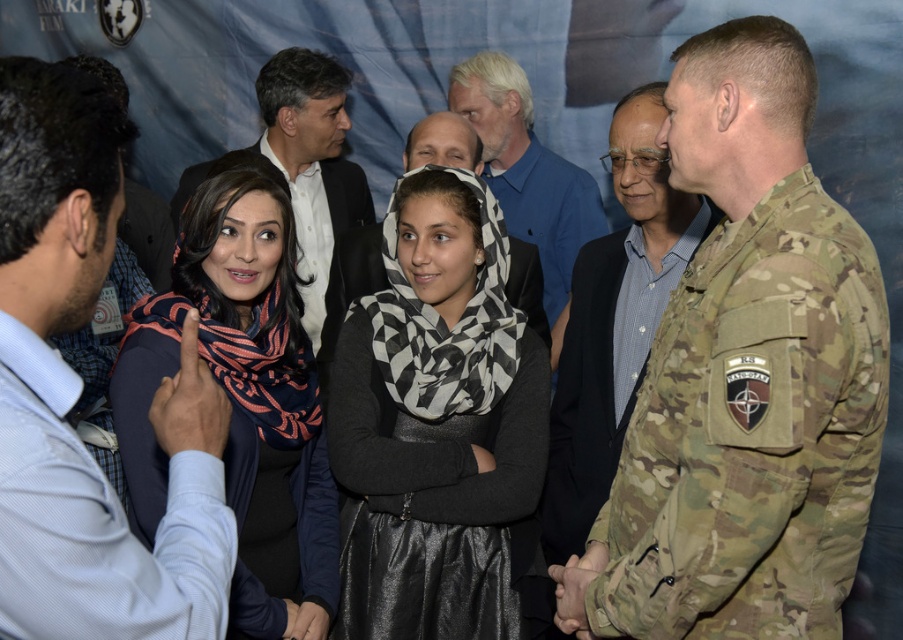
Question: Considering the real-world distances, which object is farthest from the camouflage uniform at right?

Choices:
 (A) light blue shirt at left
 (B) black and white checkered scarf at center

Answer: (A)

Question: Considering the real-world distances, which object is farthest from the blue shirt at center?

Choices:
 (A) blue and orange scarf at center
 (B) camouflage uniform at right

Answer: (A)

Question: Is the position of blue and orange scarf at center more distant than that of light blue shirt at center?

Choices:
 (A) no
 (B) yes

Answer: (A)

Question: Is black and white checkered scarf at center wider than camouflage uniform at right?

Choices:
 (A) no
 (B) yes

Answer: (B)

Question: Which of the following is the farthest from the observer?

Choices:
 (A) (617, 566)
 (B) (365, 268)
 (C) (639, 99)

Answer: (B)

Question: Can you confirm if camouflage fabric military uniform at right is wider than light blue shirt at left?

Choices:
 (A) no
 (B) yes

Answer: (B)